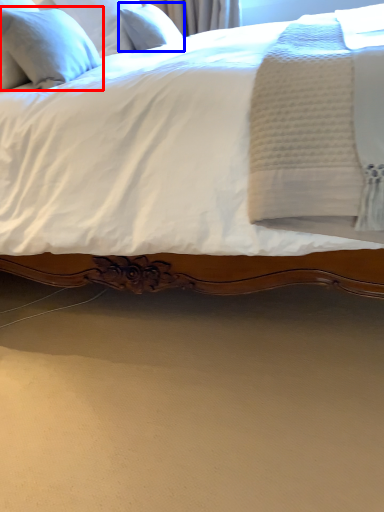
Question: Among these objects, which one is farthest to the camera, pillow (highlighted by a red box) or pillow (highlighted by a blue box)?

Choices:
 (A) pillow
 (B) pillow

Answer: (B)